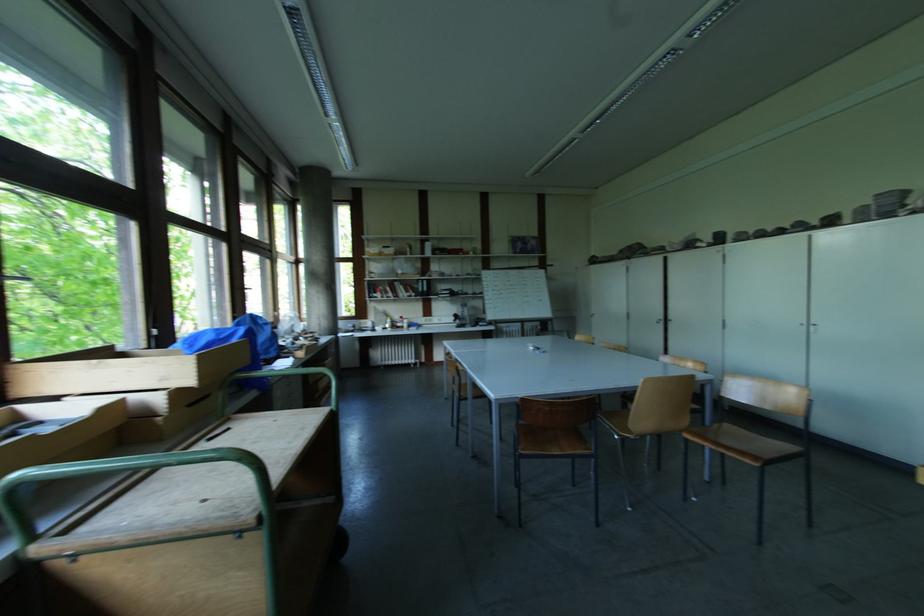
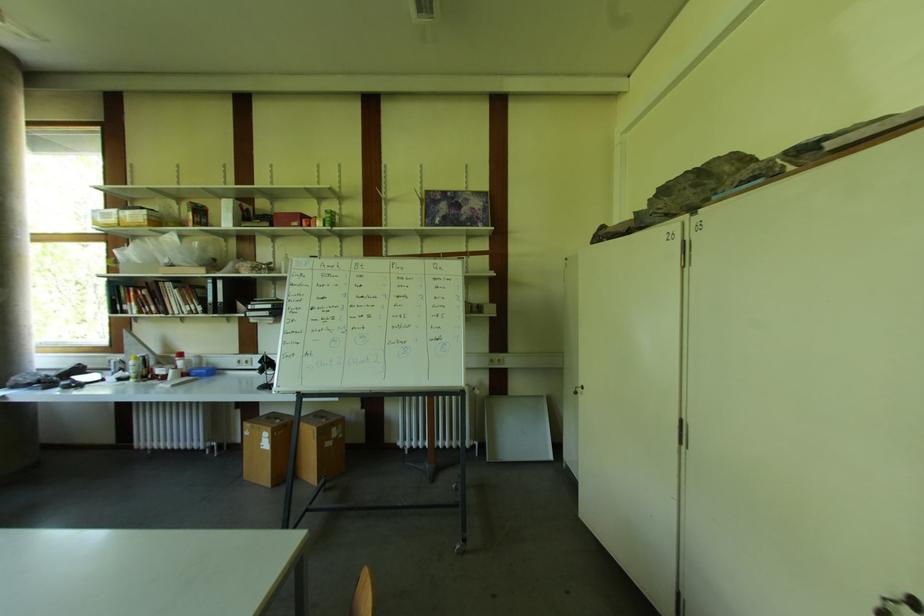
Find the pixel in the second image that matches point (464, 256) in the first image.

(298, 225)